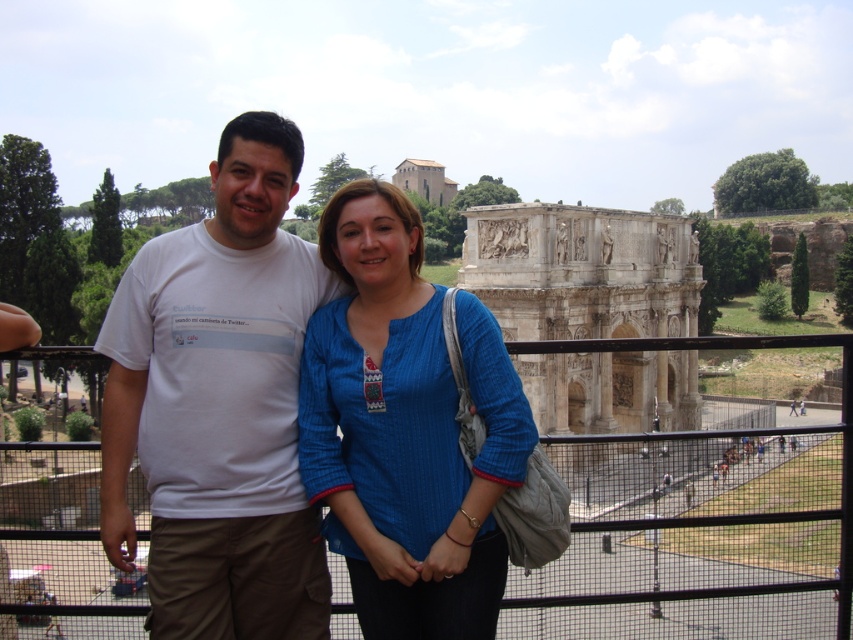
Which is above, white cotton t-shirt at center or blue ribbed shirt at center?

white cotton t-shirt at center

Can you confirm if white cotton t-shirt at center is shorter than blue ribbed shirt at center?

No, white cotton t-shirt at center is not shorter than blue ribbed shirt at center.

Where is `white cotton t-shirt at center`? white cotton t-shirt at center is located at coordinates pos(219,404).